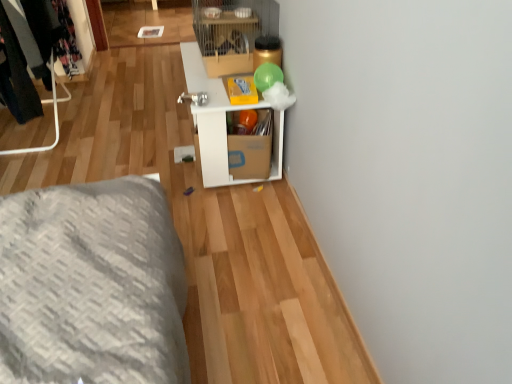
Question: Does white cardboard shelf at center have a greater height compared to metal clothing rack at left?

Choices:
 (A) yes
 (B) no

Answer: (B)

Question: Is white cardboard shelf at center to the right of metal clothing rack at left from the viewer's perspective?

Choices:
 (A) no
 (B) yes

Answer: (B)

Question: From a real-world perspective, does white cardboard shelf at center sit lower than metal clothing rack at left?

Choices:
 (A) no
 (B) yes

Answer: (B)

Question: Does white cardboard shelf at center have a larger size compared to metal clothing rack at left?

Choices:
 (A) yes
 (B) no

Answer: (A)

Question: Does white cardboard shelf at center turn towards metal clothing rack at left?

Choices:
 (A) no
 (B) yes

Answer: (B)

Question: Is the position of white cardboard shelf at center more distant than that of metal clothing rack at left?

Choices:
 (A) no
 (B) yes

Answer: (A)

Question: Considering the relative sizes of metal clothing rack at left and white cardboard shelf at center in the image provided, is metal clothing rack at left thinner than white cardboard shelf at center?

Choices:
 (A) no
 (B) yes

Answer: (B)

Question: Can you confirm if metal clothing rack at left is smaller than white cardboard shelf at center?

Choices:
 (A) no
 (B) yes

Answer: (B)

Question: Would you say metal clothing rack at left contains white cardboard shelf at center?

Choices:
 (A) yes
 (B) no

Answer: (B)

Question: Is metal clothing rack at left positioned with its back to white cardboard shelf at center?

Choices:
 (A) yes
 (B) no

Answer: (B)

Question: Can you see metal clothing rack at left touching white cardboard shelf at center?

Choices:
 (A) no
 (B) yes

Answer: (A)

Question: Considering the relative positions of metal clothing rack at left and white cardboard shelf at center in the image provided, is metal clothing rack at left to the left of white cardboard shelf at center from the viewer's perspective?

Choices:
 (A) no
 (B) yes

Answer: (B)

Question: In the image, is white cardboard shelf at center positioned in front of or behind metal clothing rack at left?

Choices:
 (A) front
 (B) behind

Answer: (A)